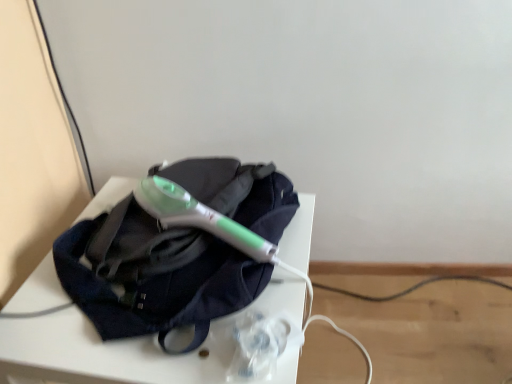
What do you see at coordinates (153, 275) in the screenshot? The width and height of the screenshot is (512, 384). I see `matte black backpack at center` at bounding box center [153, 275].

Find the location of `matte black backpack at center`. matte black backpack at center is located at coordinates (153, 275).

Where is `matte black backpack at center`? Image resolution: width=512 pixels, height=384 pixels. matte black backpack at center is located at coordinates (153, 275).